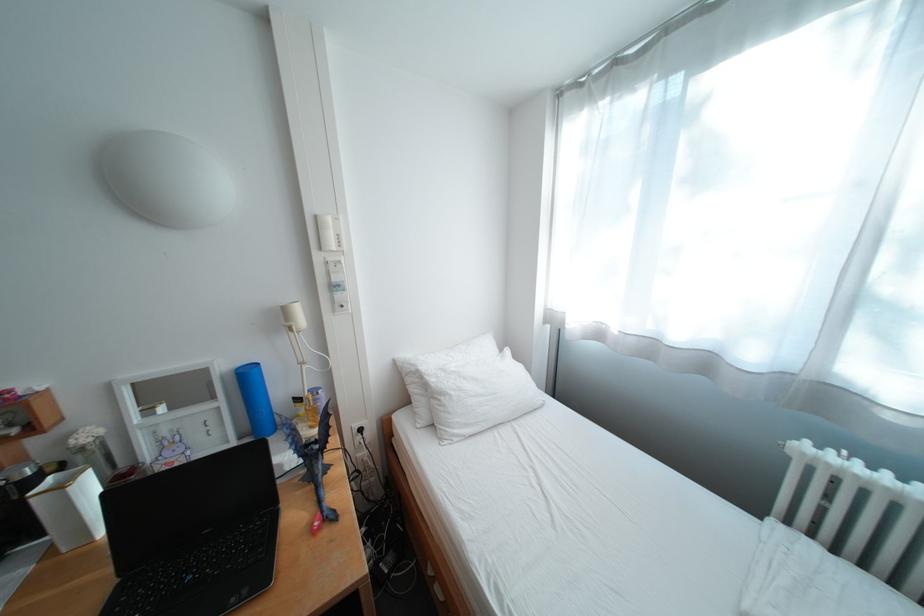
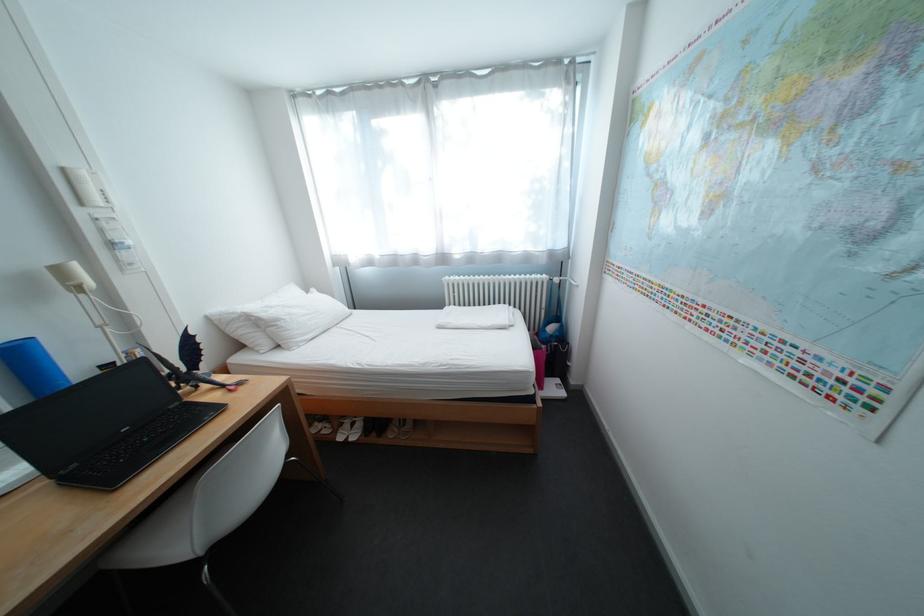
Find the pixel in the second image that matches [252,371] in the first image.

(17, 347)